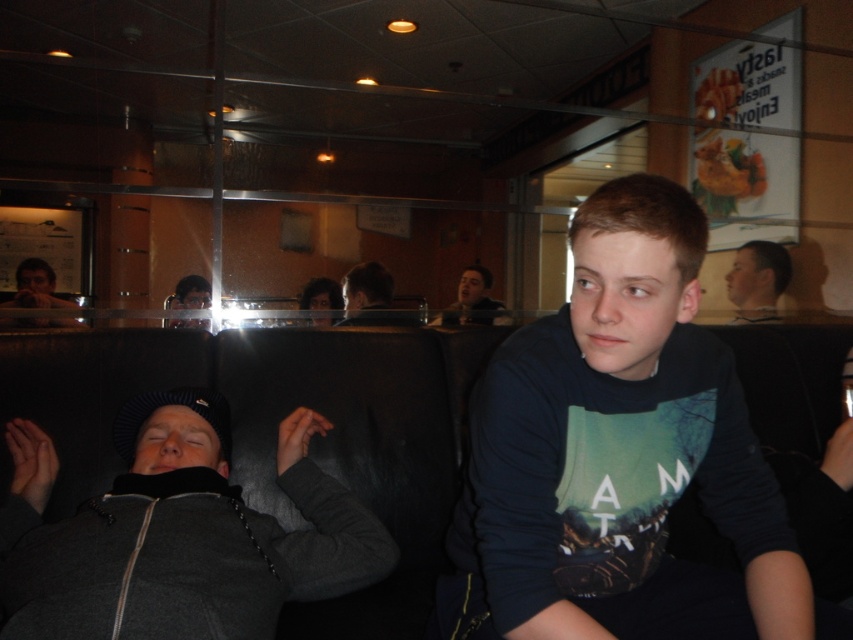
Question: Which point is closer to the camera?

Choices:
 (A) (775, 276)
 (B) (161, 595)
 (C) (619, 440)
 (D) (73, 308)

Answer: (B)

Question: Considering the relative positions of light brown hair at upper right and smooth skin face at center in the image provided, where is light brown hair at upper right located with respect to smooth skin face at center?

Choices:
 (A) above
 (B) below

Answer: (A)

Question: Which object is farther from the camera taking this photo?

Choices:
 (A) smooth skin face at center
 (B) light brown hair at upper right

Answer: (B)

Question: Is gray fleece jacket at lower left positioned behind smooth skin face at center?

Choices:
 (A) yes
 (B) no

Answer: (B)

Question: Can you confirm if gray fleece jacket at lower left is positioned to the left of matte black jacket at center?

Choices:
 (A) no
 (B) yes

Answer: (B)

Question: Which object is closer to the camera taking this photo?

Choices:
 (A) matte black laptop at left
 (B) light brown hair at upper right
 (C) dark blue cotton shirt at center
 (D) gray fleece jacket at lower left

Answer: (C)